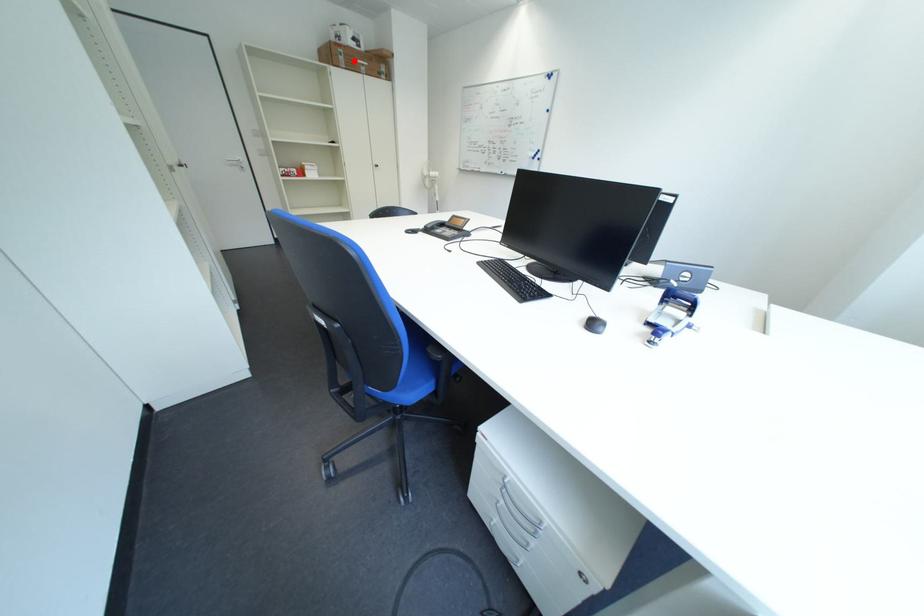
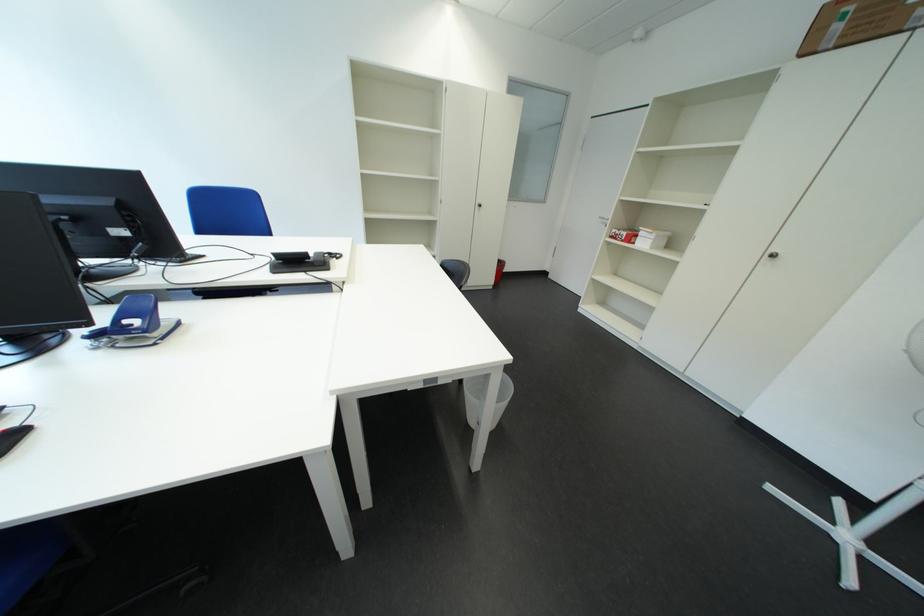
Locate, in the second image, the point that corresponds to the highlighted location in the first image.

(849, 30)